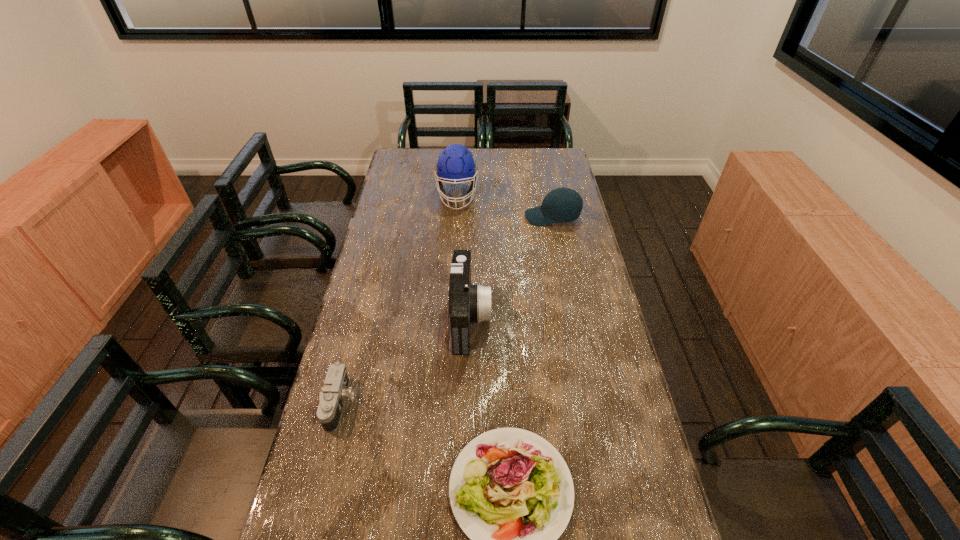
Locate an element on the screen. This screenshot has width=960, height=540. football helmet is located at coordinates (455, 164).

The height and width of the screenshot is (540, 960). I want to click on the third nearest object, so click(x=468, y=303).

What are the coordinates of `the fourth shortest object` in the screenshot? It's located at (468, 303).

The image size is (960, 540). I want to click on baseball cap, so click(x=563, y=204).

Locate an element on the screen. The height and width of the screenshot is (540, 960). camera is located at coordinates (334, 393).

Locate an element on the screen. the leftmost object is located at coordinates (334, 393).

At what (x,y) coordinates should I click in order to perform the action: click on free location located on the face guard of the football helmet. Please return your answer as a coordinate pair (x, y). Looking at the image, I should click on (453, 264).

At what (x,y) coordinates should I click in order to perform the action: click on blank space located on the lens of the second tallest object. Please return your answer as a coordinate pair (x, y). The width and height of the screenshot is (960, 540). Looking at the image, I should click on (547, 318).

Identify the location of free space located 0.160m on the front-facing side of the third shortest object. (485, 217).

I want to click on vacant region located on the front-facing side of the third shortest object, so click(494, 217).